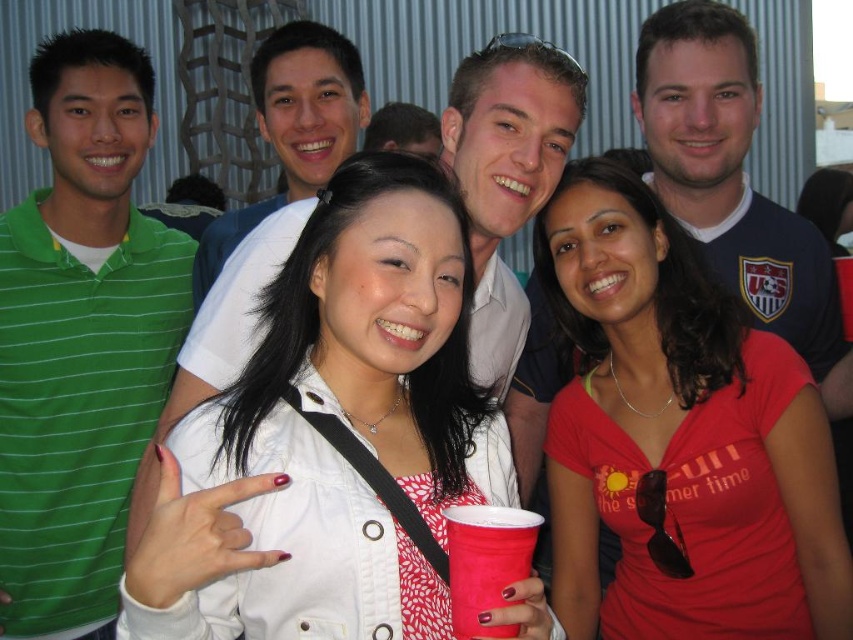
Question: Which is nearer to the matte red shirt at center?

Choices:
 (A) matte white shirt at upper center
 (B) white matte jacket at center
 (C) blue jersey at upper right
 (D) green striped polo shirt at left

Answer: (C)

Question: Which object is farther from the camera taking this photo?

Choices:
 (A) matte red shirt at center
 (B) white matte jacket at center

Answer: (A)

Question: Can you confirm if matte red shirt at center is positioned to the right of matte white shirt at upper center?

Choices:
 (A) no
 (B) yes

Answer: (B)

Question: Which of the following is the closest to the observer?

Choices:
 (A) matte red shirt at center
 (B) white matte jacket at center
 (C) matte white shirt at upper center
 (D) blue jersey at upper right

Answer: (B)

Question: Can you confirm if white matte jacket at center is wider than matte white shirt at upper center?

Choices:
 (A) no
 (B) yes

Answer: (B)

Question: Is white matte jacket at center positioned before green striped polo shirt at left?

Choices:
 (A) yes
 (B) no

Answer: (A)